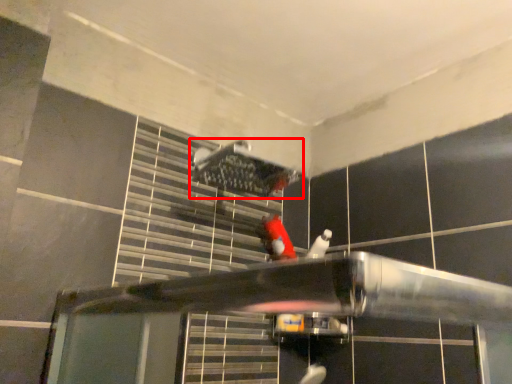
Question: From the image's perspective, what is the correct spatial positioning of shower (annotated by the red box) in reference to person?

Choices:
 (A) below
 (B) above

Answer: (B)